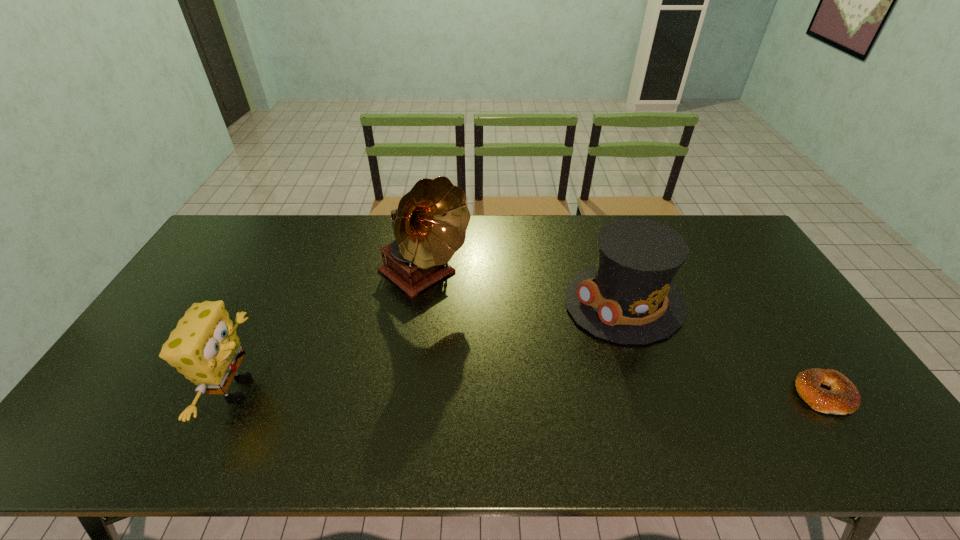
You are a GUI agent. You are given a task and a screenshot of the screen. Output one action in this format:
    pyautogui.click(x=<x>, y=<y>)
    Task: Click on the vacant space on the desktop that is between the sponge and the shortest object and is positioned on the horn of the third object from right to left
    Image resolution: width=960 pixels, height=540 pixels.
    Given the screenshot: What is the action you would take?
    pyautogui.click(x=571, y=392)

Where is `vacant space on the desktop that is between the leftmost object and the bagel and is positioned with goggles on the front of the dress hat`? The width and height of the screenshot is (960, 540). vacant space on the desktop that is between the leftmost object and the bagel and is positioned with goggles on the front of the dress hat is located at coordinates (442, 391).